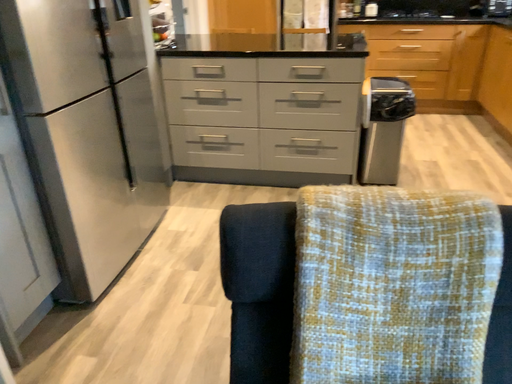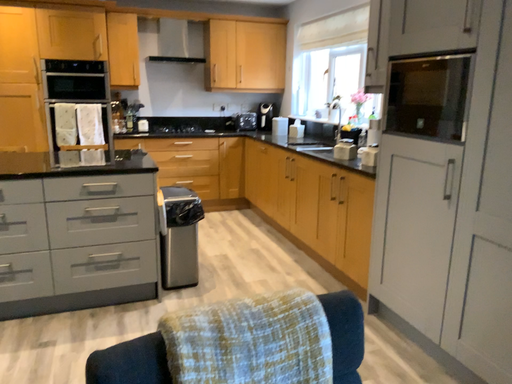
Question: How did the camera likely rotate when shooting the video?

Choices:
 (A) rotated left
 (B) rotated right

Answer: (B)